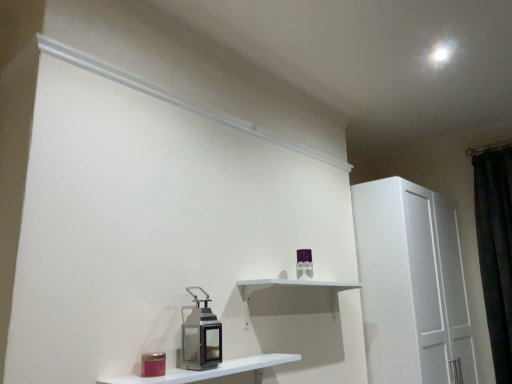
Question: Is white glossy shelf at lower center, the first shelf in the front-to-back sequence, wider than metallic lantern at center?

Choices:
 (A) no
 (B) yes

Answer: (B)

Question: Can you confirm if white glossy shelf at lower center, which ranks as the 2th shelf in back-to-front order, is thinner than metallic lantern at center?

Choices:
 (A) yes
 (B) no

Answer: (B)

Question: From a real-world perspective, is white glossy shelf at lower center, the first shelf in the front-to-back sequence, physically below metallic lantern at center?

Choices:
 (A) no
 (B) yes

Answer: (B)

Question: Does white glossy shelf at lower center, the first shelf in the front-to-back sequence, turn towards metallic lantern at center?

Choices:
 (A) yes
 (B) no

Answer: (B)

Question: Is white glossy shelf at lower center, which ranks as the 2th shelf in back-to-front order, next to metallic lantern at center and touching it?

Choices:
 (A) no
 (B) yes

Answer: (A)

Question: Considering the positions of point (126, 375) and point (247, 306), is point (126, 375) closer or farther from the camera than point (247, 306)?

Choices:
 (A) closer
 (B) farther

Answer: (A)

Question: From a real-world perspective, is white glossy shelf at lower center, the first shelf in the front-to-back sequence, physically located above or below white matte shelf at center, which is counted as the first shelf, starting from the back?

Choices:
 (A) above
 (B) below

Answer: (B)

Question: Would you say white glossy shelf at lower center, which ranks as the 2th shelf in back-to-front order, is to the left or to the right of white matte shelf at center, which is the second shelf in front-to-back order, in the picture?

Choices:
 (A) right
 (B) left

Answer: (B)

Question: Is white glossy shelf at lower center, the first shelf in the front-to-back sequence, spatially inside white matte shelf at center, which is counted as the first shelf, starting from the back, or outside of it?

Choices:
 (A) inside
 (B) outside

Answer: (B)

Question: In terms of width, does white matte shelf at center, which is counted as the first shelf, starting from the back, look wider or thinner when compared to white glossy shelf at lower center, the first shelf in the front-to-back sequence?

Choices:
 (A) thin
 (B) wide

Answer: (A)

Question: From the image's perspective, relative to white glossy shelf at lower center, the first shelf in the front-to-back sequence, is white matte shelf at center, which is counted as the first shelf, starting from the back, above or below?

Choices:
 (A) below
 (B) above

Answer: (B)

Question: Is white matte shelf at center, which is the second shelf in front-to-back order, taller or shorter than white glossy shelf at lower center, the first shelf in the front-to-back sequence?

Choices:
 (A) tall
 (B) short

Answer: (A)

Question: From a real-world perspective, is white matte shelf at center, which is counted as the first shelf, starting from the back, positioned above or below white glossy shelf at lower center, which ranks as the 2th shelf in back-to-front order?

Choices:
 (A) below
 (B) above

Answer: (B)

Question: From the image's perspective, is white matte shelf at center, which is the second shelf in front-to-back order, above or below dark velvet curtain at right?

Choices:
 (A) above
 (B) below

Answer: (B)

Question: Visually, is white matte shelf at center, which is the second shelf in front-to-back order, positioned to the left or to the right of dark velvet curtain at right?

Choices:
 (A) right
 (B) left

Answer: (B)